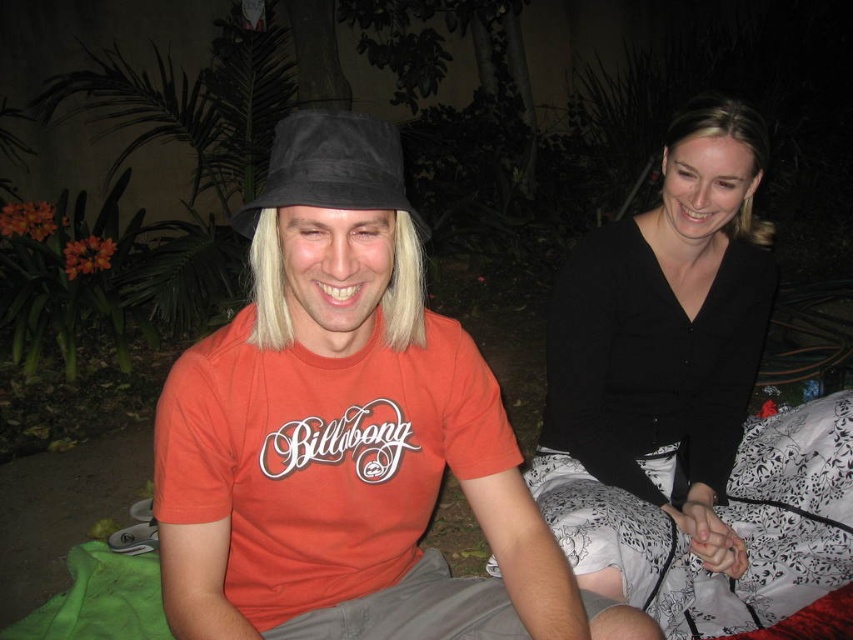
You are standing 1.5 meters away from the camera. Can you reach the point at coordinates point [683,237] without moving your position?

The distance of point [683,237] from camera is 1.49 meters, so yes, you can reach the point at coordinates point [683,237] without moving your position since you are only 1.5 meters away from the camera, which is slightly farther than the point.

You are standing at point (347,116) and want to walk to point (614,336). Which direction should you move in?

You should move backward to reach point (614,336) because it is behind point (347,116).

From the picture: You are a photographer trying to decide which object to focus on first between the matte black bucket hat at left and the black matte shirt at upper right. Based on their heights, which one should you focus on first?

The matte black bucket hat at left is not as tall as the black matte shirt at upper right, so you should focus on the black matte shirt at upper right first because it is taller.